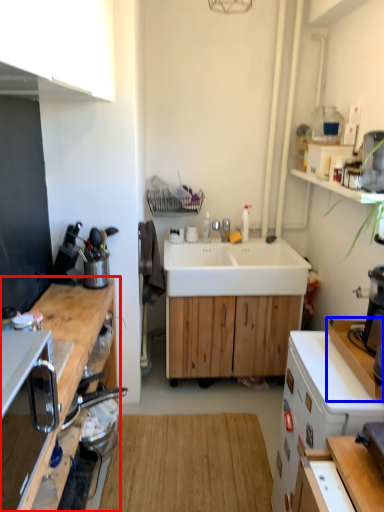
Question: Which object is further to the camera taking this photo, cabinetry (highlighted by a red box) or counter top (highlighted by a blue box)?

Choices:
 (A) cabinetry
 (B) counter top

Answer: (B)